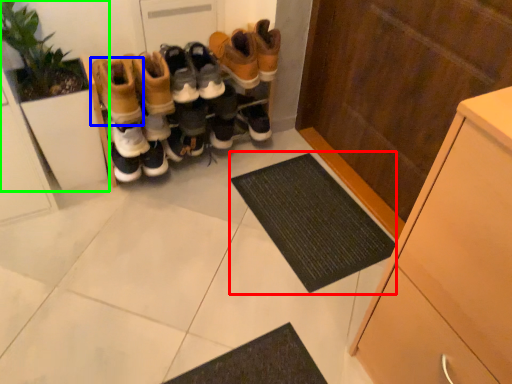
Question: Estimate the real-world distances between objects in this image. Which object is farther from doormat (highlighted by a red box), footwear (highlighted by a blue box) or houseplant (highlighted by a green box)?

Choices:
 (A) footwear
 (B) houseplant

Answer: (B)